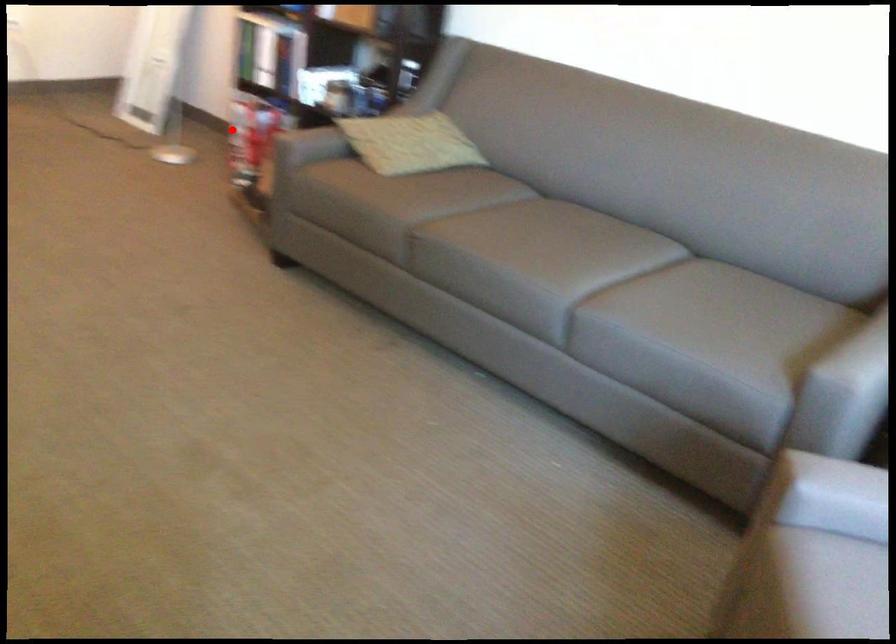
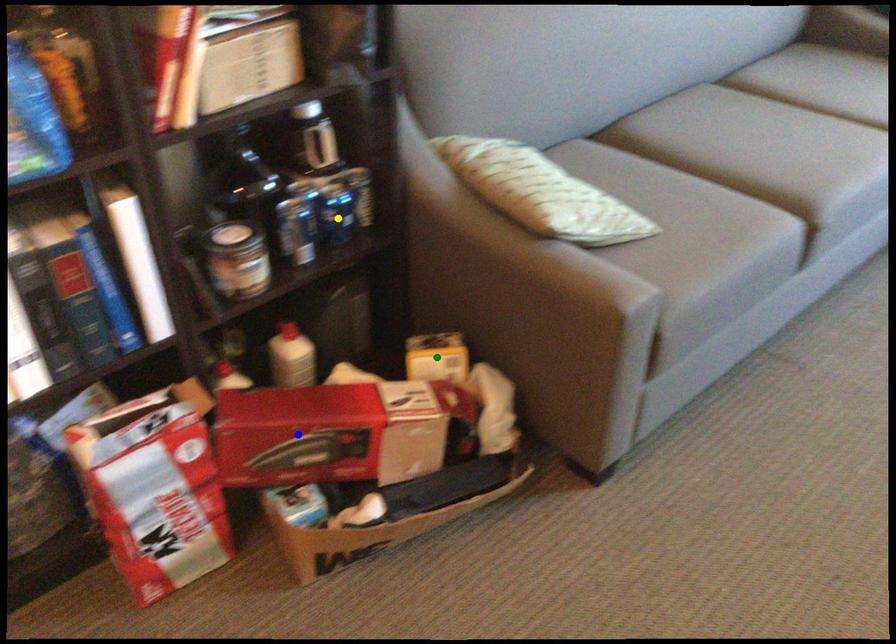
Question: I am providing you with two images of the same scene from different viewpoints. A red point is marked on the first image. You are given multiple points on the second image. Which point in image 2 is actually the same real-world point as the red point in image 1?

Choices:
 (A) green point
 (B) blue point
 (C) yellow point

Answer: (B)